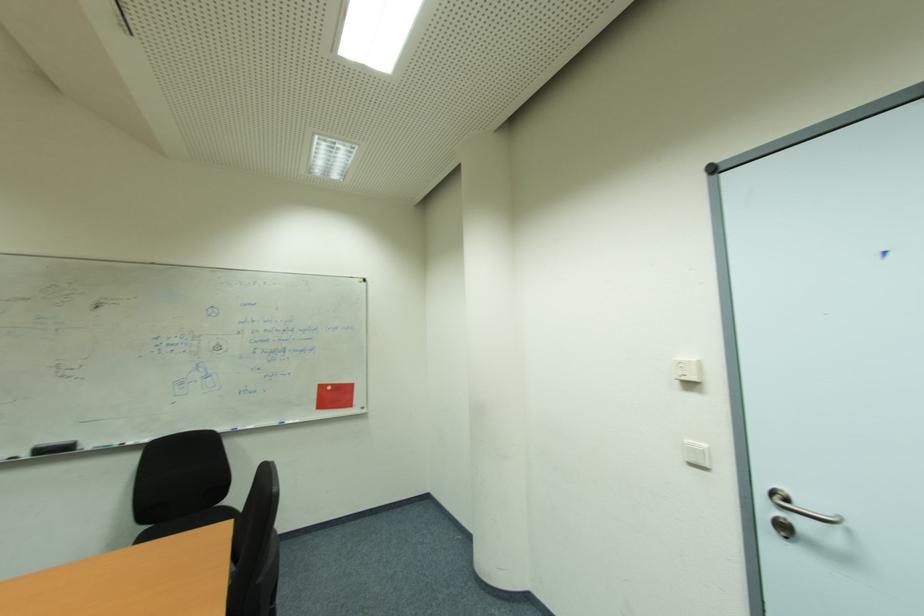
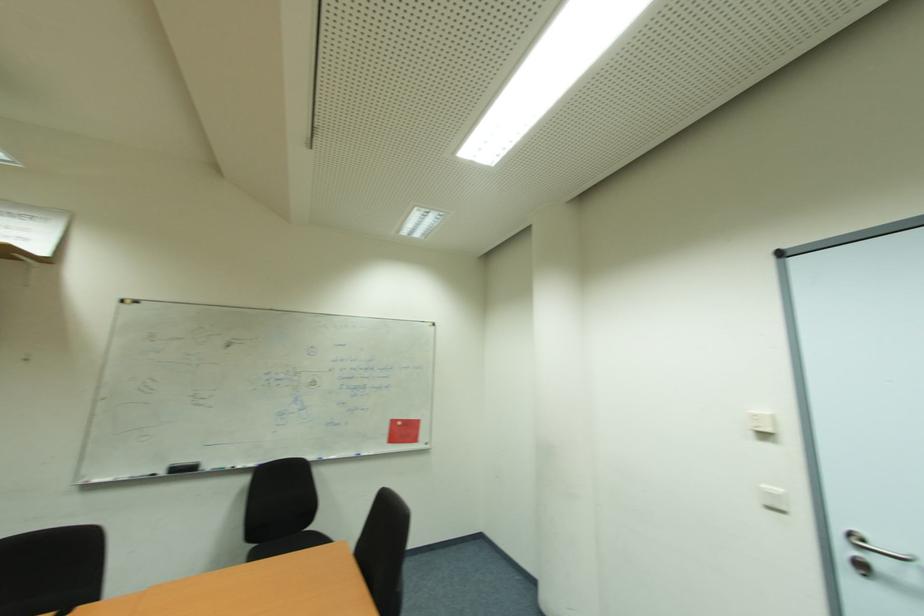
In the second image, find the point that corresponds to point (698, 360) in the first image.

(771, 414)